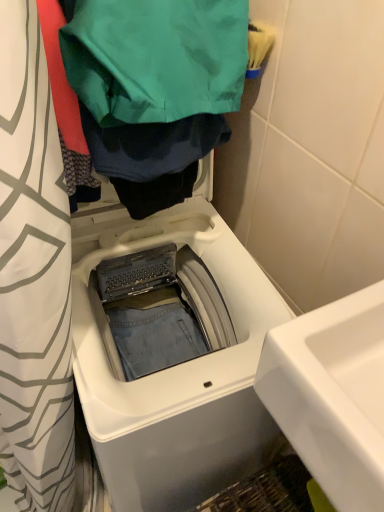
In order to face green fabric bag at upper center, should I rotate leftwards or rightwards?

A 2.492 degree turn to the left will do.

Where is `white glossy sink at lower right`? This screenshot has height=512, width=384. white glossy sink at lower right is located at coordinates (332, 395).

Measure the distance from white glossy sink at lower right to white plastic washing machine at center.

white glossy sink at lower right is 30.61 centimeters from white plastic washing machine at center.

Is white glossy sink at lower right next to white plastic washing machine at center and touching it?

There is a gap between white glossy sink at lower right and white plastic washing machine at center.

Locate an element on the screen. This screenshot has height=512, width=384. sink above the white plastic washing machine at center (from the image's perspective) is located at coordinates (332, 395).

Could you tell me if white glossy sink at lower right is facing white plastic washing machine at center?

No, white glossy sink at lower right is not facing towards white plastic washing machine at center.

From the image's perspective, is green fabric bag at upper center on top of white plastic washing machine at center?

Indeed, from the image's perspective, green fabric bag at upper center is shown above white plastic washing machine at center.

Is green fabric bag at upper center to the left or to the right of white plastic washing machine at center in the image?

Based on their positions, green fabric bag at upper center is located to the right of white plastic washing machine at center.

Considering the sizes of objects green fabric bag at upper center and white plastic washing machine at center in the image provided, who is smaller, green fabric bag at upper center or white plastic washing machine at center?

green fabric bag at upper center.

From a real-world perspective, which object stands above the other?

From a 3D spatial view, green fabric bag at upper center is above.

Considering the points (174, 390) and (91, 83), which point is behind, point (174, 390) or point (91, 83)?

The point (174, 390) is more distant.

Is green fabric bag at upper center surrounded by white plastic washing machine at center?

No, green fabric bag at upper center is not inside white plastic washing machine at center.

Are white plastic washing machine at center and green fabric bag at upper center far apart?

That's not correct — white plastic washing machine at center is a little close to green fabric bag at upper center.

What's the angular difference between white glossy sink at lower right and green fabric bag at upper center's facing directions?

85.5 degrees.

Which of these two, white glossy sink at lower right or green fabric bag at upper center, stands taller?

Standing taller between the two is green fabric bag at upper center.

The width and height of the screenshot is (384, 512). Identify the location of sink below the green fabric bag at upper center (from a real-world perspective). (332, 395).

Could you tell me if white glossy sink at lower right is turned towards green fabric bag at upper center?

No, white glossy sink at lower right is not turned towards green fabric bag at upper center.

Does green fabric bag at upper center have a larger size compared to white glossy sink at lower right?

Yes, green fabric bag at upper center is bigger than white glossy sink at lower right.

Locate an element on the screen. This screenshot has height=512, width=384. sink below the green fabric bag at upper center (from a real-world perspective) is located at coordinates (332, 395).

From a real-world perspective, is green fabric bag at upper center positioned above or below white glossy sink at lower right?

Clearly, from a real-world perspective, green fabric bag at upper center is above white glossy sink at lower right.

From a real-world perspective, relative to white glossy sink at lower right, is white plastic washing machine at center vertically above or below?

white plastic washing machine at center is situated lower than white glossy sink at lower right in the real world.

Is white plastic washing machine at center surrounding white glossy sink at lower right?

That's incorrect, white glossy sink at lower right is not inside white plastic washing machine at center.

Considering the relative positions of white plastic washing machine at center and white glossy sink at lower right in the image provided, is white plastic washing machine at center to the left of white glossy sink at lower right from the viewer's perspective?

Yes, white plastic washing machine at center is to the left of white glossy sink at lower right.

Identify the location of sink lying above the white plastic washing machine at center (from the image's perspective). (332, 395).

This screenshot has width=384, height=512. Find the location of `washing machine behind the white glossy sink at lower right`. washing machine behind the white glossy sink at lower right is located at coordinates (177, 365).

Locate an element on the screen. Image resolution: width=384 pixels, height=512 pixels. clothing on the right side of white plastic washing machine at center is located at coordinates (155, 58).

Based on their spatial positions, is green fabric bag at upper center or white glossy sink at lower right further from white plastic washing machine at center?

green fabric bag at upper center lies further to white plastic washing machine at center than the other object.

Which object lies further to the anchor point green fabric bag at upper center, white plastic washing machine at center or white glossy sink at lower right?

white glossy sink at lower right is further to green fabric bag at upper center.

When comparing their distances from white plastic washing machine at center, does white glossy sink at lower right or green fabric bag at upper center seem further?

Based on the image, green fabric bag at upper center appears to be further to white plastic washing machine at center.

Based on the photo, from the image, which object appears to be nearer to white glossy sink at lower right, green fabric bag at upper center or white plastic washing machine at center?

Among the two, white plastic washing machine at center is located nearer to white glossy sink at lower right.

Which object lies further to the anchor point white glossy sink at lower right, white plastic washing machine at center or green fabric bag at upper center?

Among the two, green fabric bag at upper center is located further to white glossy sink at lower right.

Which object lies further to the anchor point green fabric bag at upper center, white glossy sink at lower right or white plastic washing machine at center?

white glossy sink at lower right.

Locate an element on the screen. The height and width of the screenshot is (512, 384). sink between green fabric bag at upper center and white plastic washing machine at center vertically is located at coordinates (332, 395).